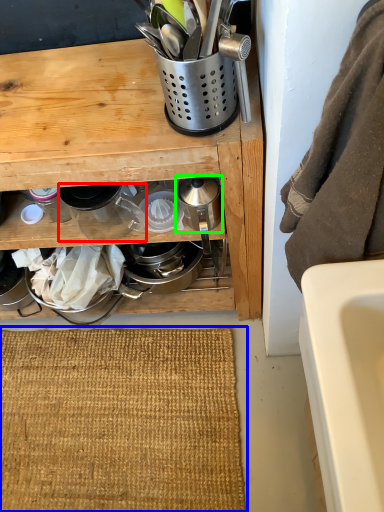
Question: Estimate the real-world distances between objects in this image. Which object is farther from appliance (highlighted by a red box), doormat (highlighted by a blue box) or appliance (highlighted by a green box)?

Choices:
 (A) doormat
 (B) appliance

Answer: (A)